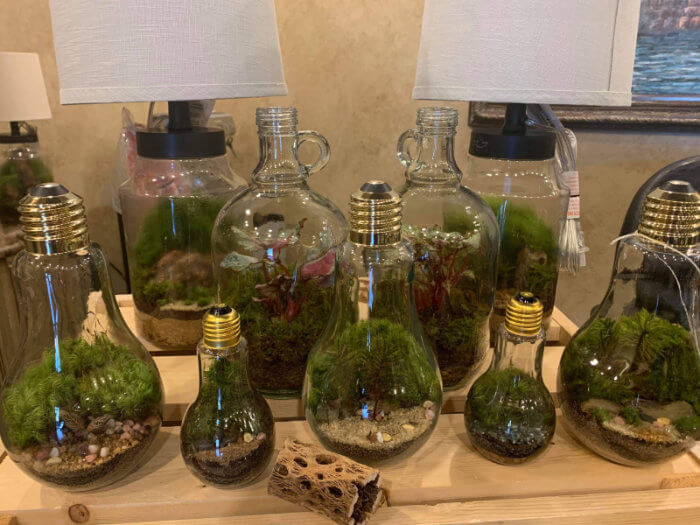
Locate an element on the screen. jar is located at coordinates (498, 199), (182, 207), (18, 170).